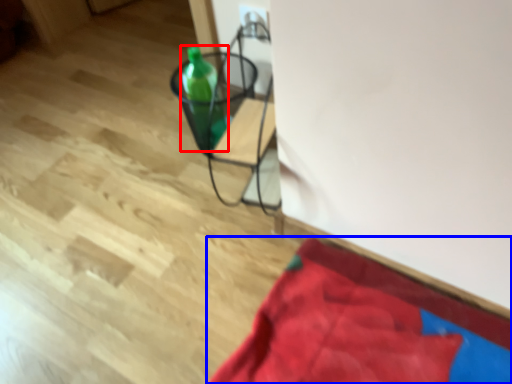
Question: Which point is closer to the camera, bottle (highlighted by a red box) or blanket (highlighted by a blue box)?

Choices:
 (A) bottle
 (B) blanket

Answer: (B)